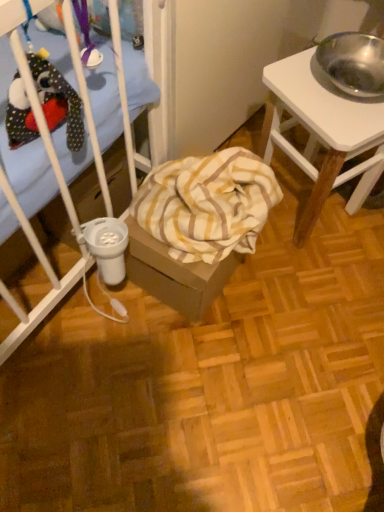
Question: Should I look upward or downward to see white wood desk at right?

Choices:
 (A) up
 (B) down

Answer: (A)

Question: Considering the relative positions of yellow striped fabric at center and white wood desk at right in the image provided, is yellow striped fabric at center in front of white wood desk at right?

Choices:
 (A) yes
 (B) no

Answer: (B)

Question: Considering the relative positions of yellow striped fabric at center and white wood desk at right in the image provided, is yellow striped fabric at center to the left of white wood desk at right from the viewer's perspective?

Choices:
 (A) yes
 (B) no

Answer: (A)

Question: Is yellow striped fabric at center not near white wood desk at right?

Choices:
 (A) yes
 (B) no

Answer: (B)

Question: Is yellow striped fabric at center taller than white wood desk at right?

Choices:
 (A) yes
 (B) no

Answer: (B)

Question: Is yellow striped fabric at center looking in the opposite direction of white wood desk at right?

Choices:
 (A) no
 (B) yes

Answer: (A)

Question: Can you confirm if yellow striped fabric at center is smaller than white wood desk at right?

Choices:
 (A) yes
 (B) no

Answer: (A)

Question: Does white wood desk at right have a lesser height compared to yellow striped fabric at center?

Choices:
 (A) no
 (B) yes

Answer: (A)

Question: Can you confirm if white wood desk at right is wider than yellow striped fabric at center?

Choices:
 (A) yes
 (B) no

Answer: (A)

Question: Is white wood desk at right outside yellow striped fabric at center?

Choices:
 (A) yes
 (B) no

Answer: (A)

Question: Is yellow striped fabric at center at the back of white wood desk at right?

Choices:
 (A) yes
 (B) no

Answer: (B)

Question: Does white wood desk at right have a larger size compared to yellow striped fabric at center?

Choices:
 (A) no
 (B) yes

Answer: (B)

Question: Does white wood desk at right appear on the right side of yellow striped fabric at center?

Choices:
 (A) no
 (B) yes

Answer: (B)

Question: Is white wood desk at right in front of or behind yellow striped fabric at center in the image?

Choices:
 (A) front
 (B) behind

Answer: (A)